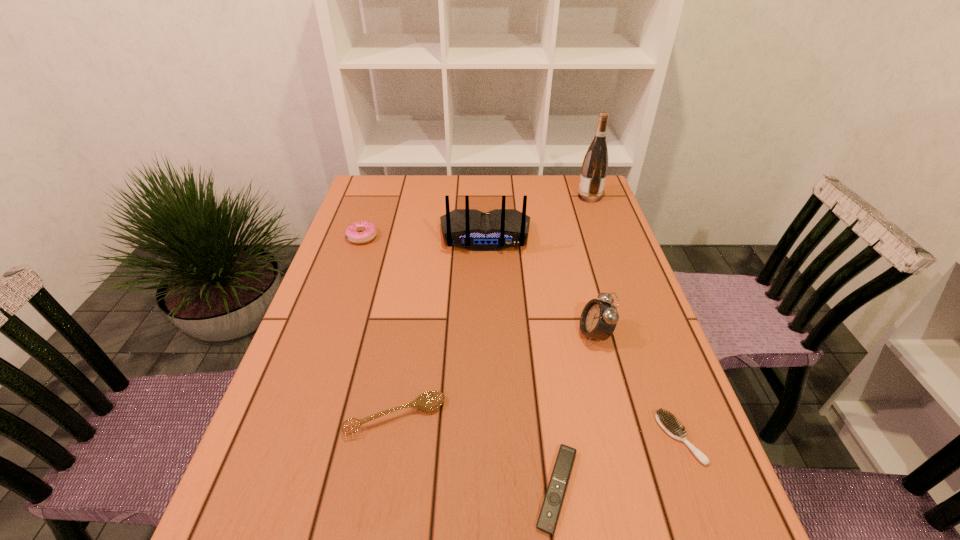
Where is `vacant area at the right edge of the desktop`? vacant area at the right edge of the desktop is located at coordinates (629, 355).

At what (x,y) coordinates should I click in order to perform the action: click on empty space that is in between the shortest object and the fourth tallest object. Please return your answer as a coordinate pair (x, y). Looking at the image, I should click on (460, 363).

Identify the location of free spot between the sixth tallest object and the tallest object. Image resolution: width=960 pixels, height=540 pixels. (635, 318).

Identify the location of free spot between the alarm clock and the tallest object. The height and width of the screenshot is (540, 960). (592, 266).

Where is `free space between the fifth object from left to right and the sixth shortest object`? free space between the fifth object from left to right and the sixth shortest object is located at coordinates (540, 285).

You are a GUI agent. You are given a task and a screenshot of the screen. Output one action in this format:
    pyautogui.click(x=<x>, y=<y>)
    Task: Click on the vacant area between the router and the third tallest object
    The image size is (960, 540).
    Given the screenshot: What is the action you would take?
    pyautogui.click(x=540, y=285)

Locate an element on the screen. This screenshot has height=540, width=960. unoccupied position between the farthest object and the remote control is located at coordinates 573,343.

You are a GUI agent. You are given a task and a screenshot of the screen. Output one action in this format:
    pyautogui.click(x=<x>, y=<y>)
    Task: Click on the unoccupied area between the ladle and the remote control
    
    Given the screenshot: What is the action you would take?
    pyautogui.click(x=476, y=453)

Locate an element on the screen. Image resolution: width=960 pixels, height=540 pixels. blank region between the leftmost object and the alarm clock is located at coordinates (478, 286).

Where is `free space between the farthest object and the shortest object`? This screenshot has width=960, height=540. free space between the farthest object and the shortest object is located at coordinates (573, 343).